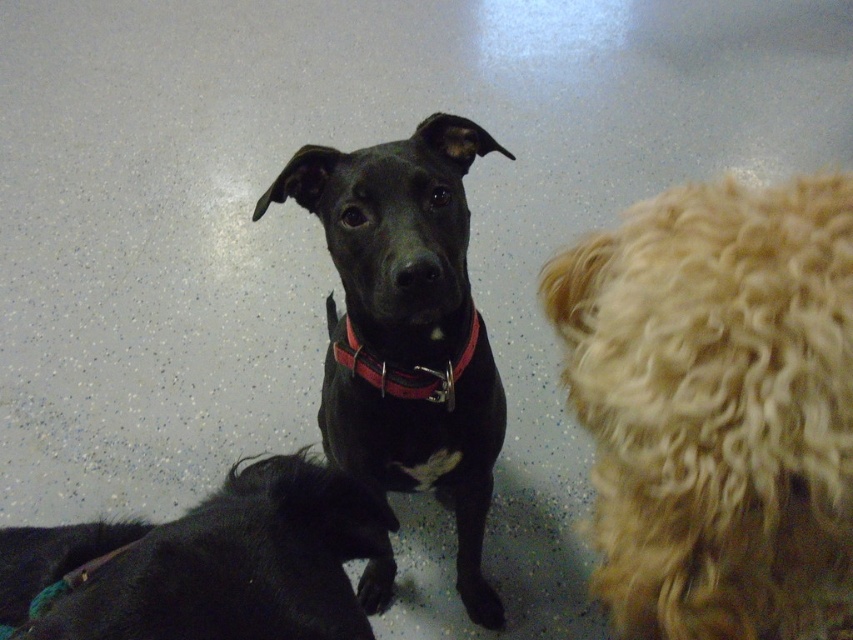
Does shiny black fur at lower left have a larger size compared to red leather collar at center?

Correct, shiny black fur at lower left is larger in size than red leather collar at center.

Does shiny black fur at lower left have a greater height compared to red leather collar at center?

Yes.

Looking at this image, who is more distant from viewer, [306,593] or [396,371]?

The point [396,371] is more distant.

Locate an element on the screen. shiny black fur at lower left is located at coordinates (207, 563).

Is black matte dog at center to the right of red leather collar at center from the viewer's perspective?

In fact, black matte dog at center is to the left of red leather collar at center.

Who is more forward, [498,621] or [397,387]?

Point [397,387] is more forward.

Between point (360, 408) and point (343, 346), which one is positioned behind?

The point (360, 408) is behind.

Locate an element on the screen. This screenshot has width=853, height=640. black matte dog at center is located at coordinates (407, 326).

Based on the photo, can you confirm if curly blonde fur at right is positioned below red leather collar at center?

Yes, curly blonde fur at right is below red leather collar at center.

Who is higher up, curly blonde fur at right or red leather collar at center?

red leather collar at center is above.

Locate an element on the screen. Image resolution: width=853 pixels, height=640 pixels. curly blonde fur at right is located at coordinates (717, 404).

You are a GUI agent. You are given a task and a screenshot of the screen. Output one action in this format:
    pyautogui.click(x=<x>, y=<y>)
    Task: Click on the curly blonde fur at right
    
    Given the screenshot: What is the action you would take?
    pyautogui.click(x=717, y=404)